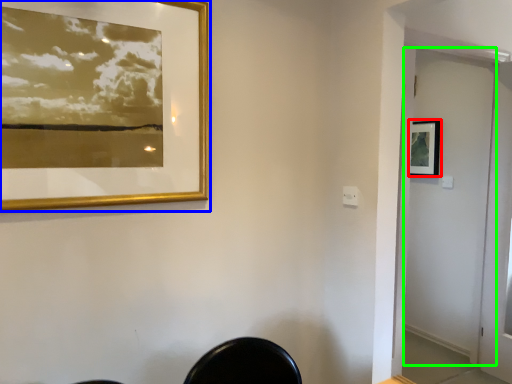
Question: Estimate the real-world distances between objects in this image. Which object is farther from picture frame (highlighted by a red box), picture frame (highlighted by a blue box) or screen door (highlighted by a green box)?

Choices:
 (A) picture frame
 (B) screen door

Answer: (A)